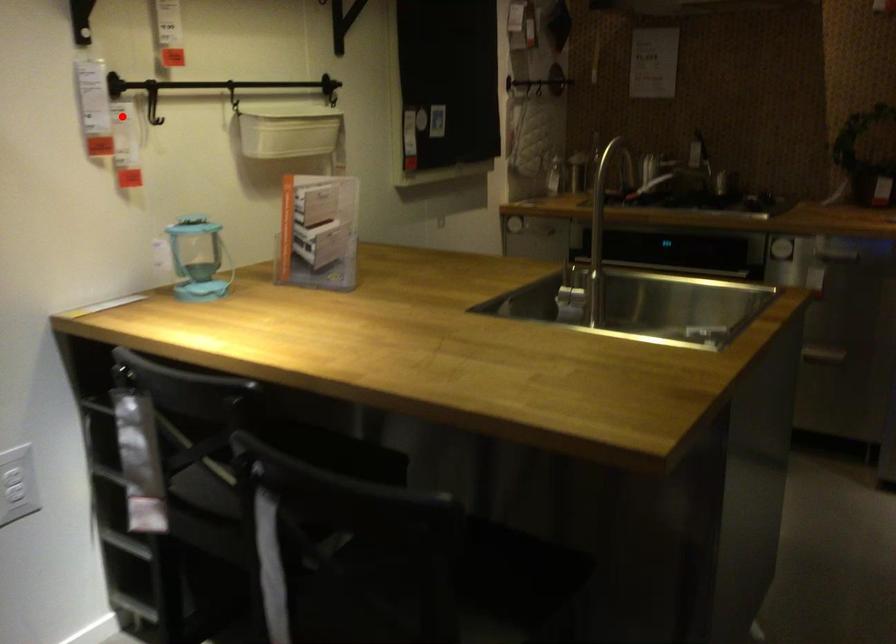
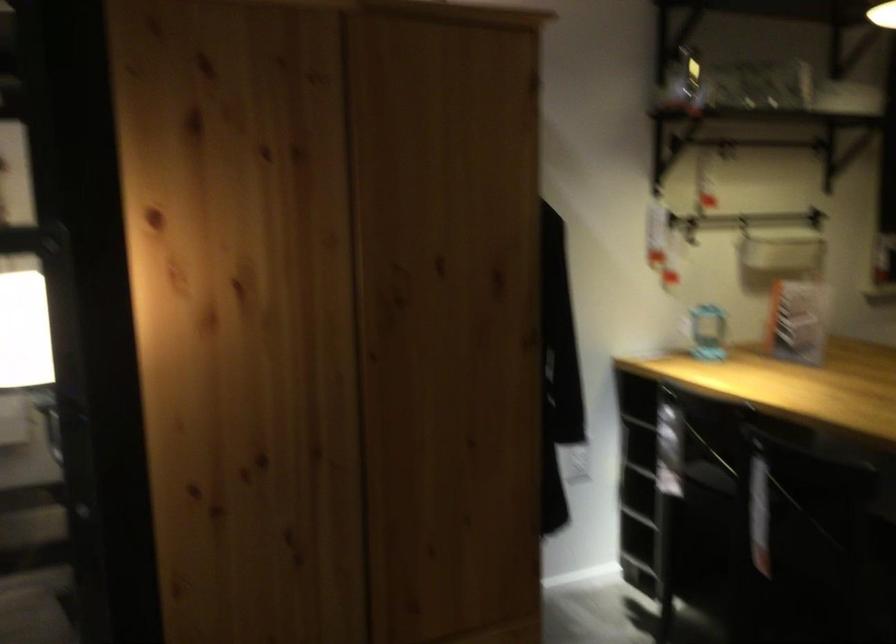
Question: I am providing you with two images of the same scene from different viewpoints. A red point is shown in image1. For the corresponding object point in image2, is it positioned nearer or farther from the camera?

Choices:
 (A) Nearer
 (B) Farther

Answer: (B)